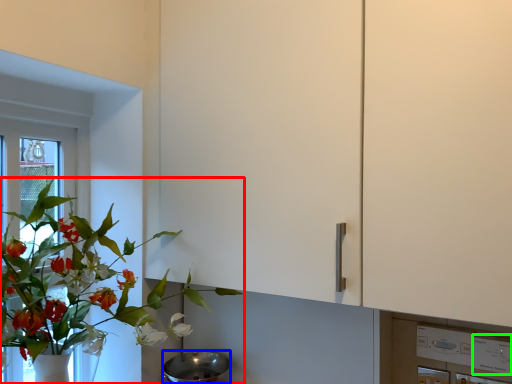
Question: Which is farther away from houseplant (highlighted by a red box)? mixing bowl (highlighted by a blue box) or appliance (highlighted by a green box)?

Choices:
 (A) mixing bowl
 (B) appliance

Answer: (B)